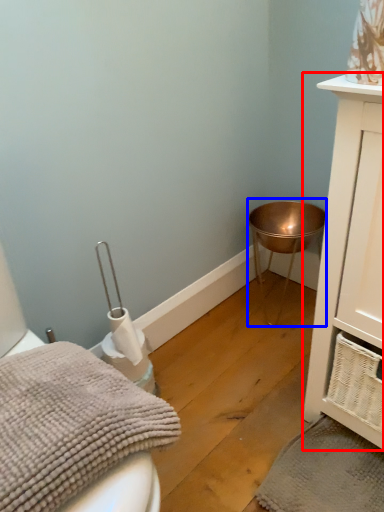
Question: Which point is closer to the camera, bathroom cabinet (highlighted by a red box) or changing table (highlighted by a blue box)?

Choices:
 (A) bathroom cabinet
 (B) changing table

Answer: (A)